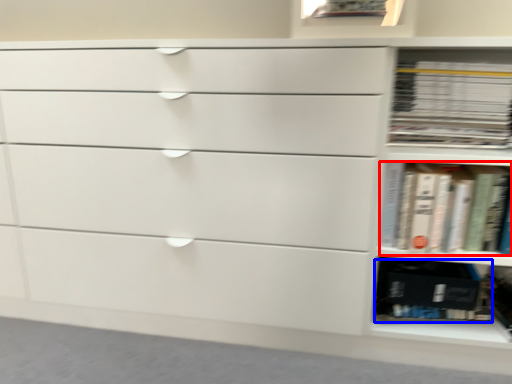
Question: Which point is closer to the camera, book (highlighted by a red box) or paperback book (highlighted by a blue box)?

Choices:
 (A) book
 (B) paperback book

Answer: (A)